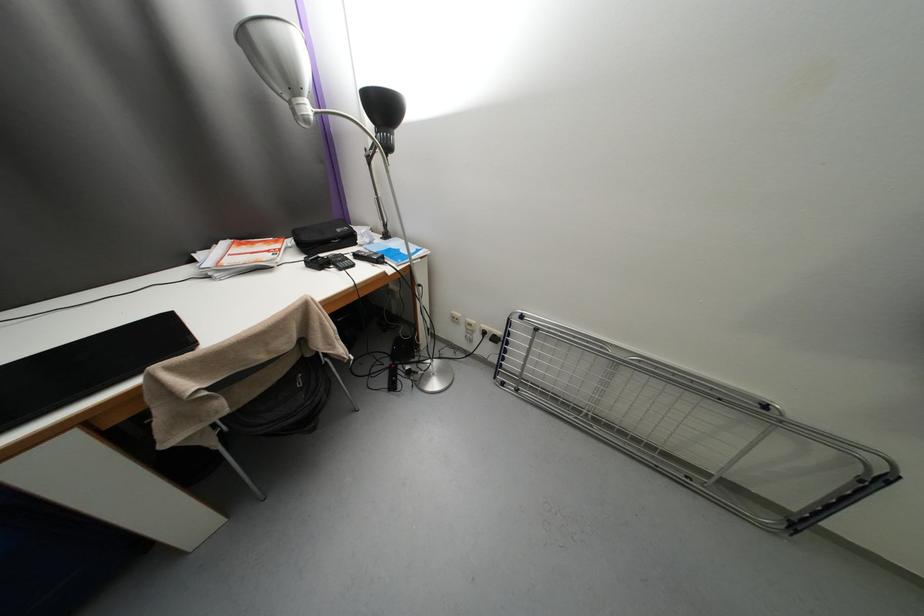
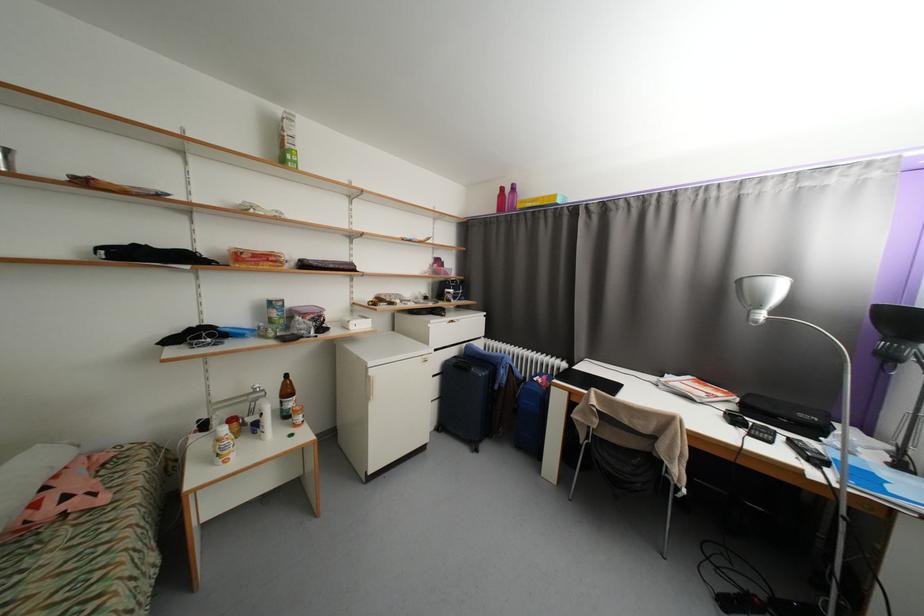
In the second image, find the point that corresponds to the point at 346,270 in the first image.

(757, 436)